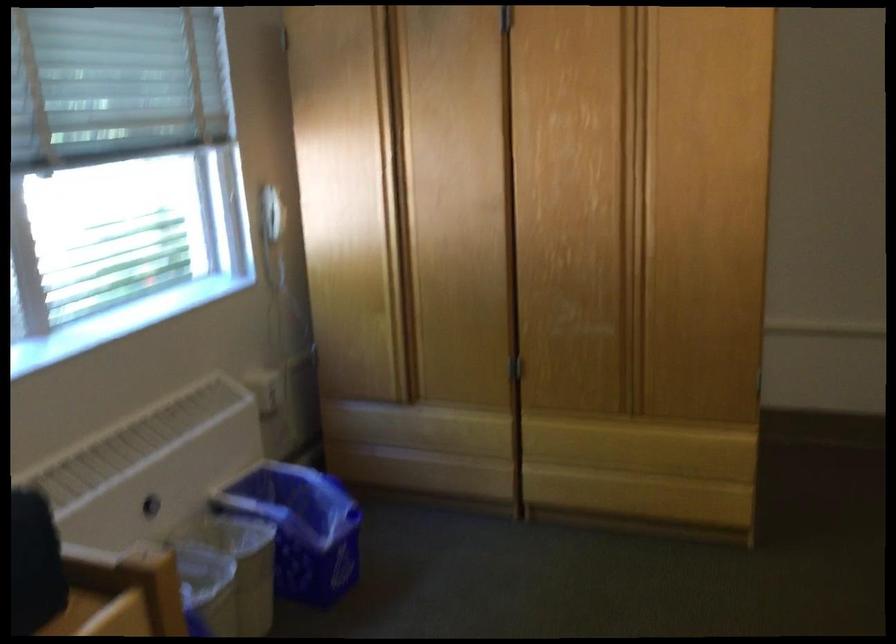
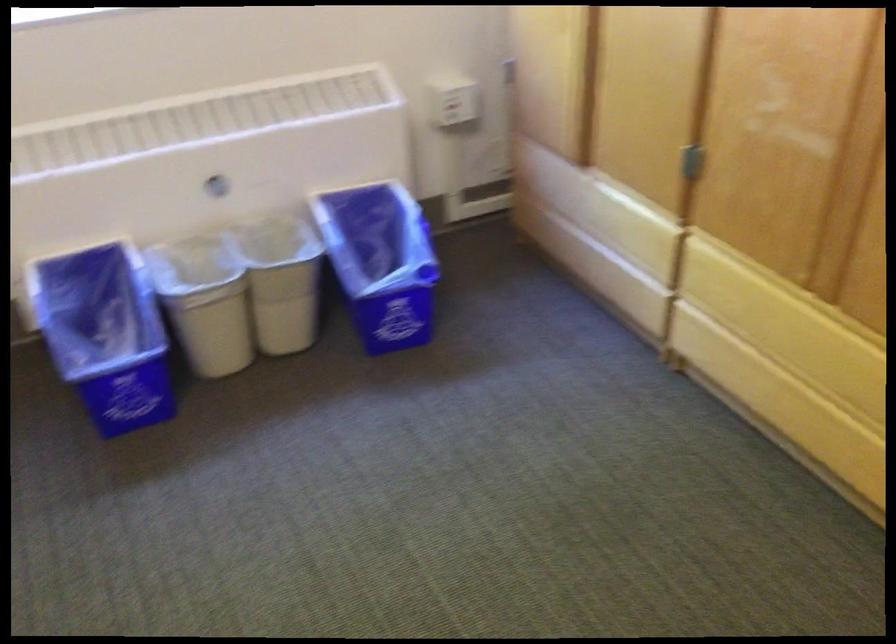
Find the pixel in the second image that matches point 271,389 in the first image.

(452, 100)